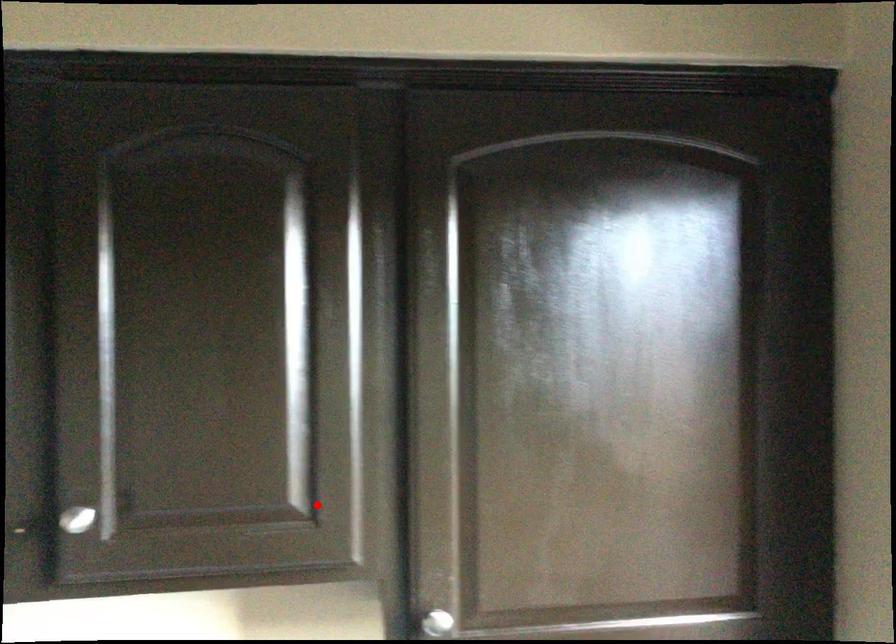
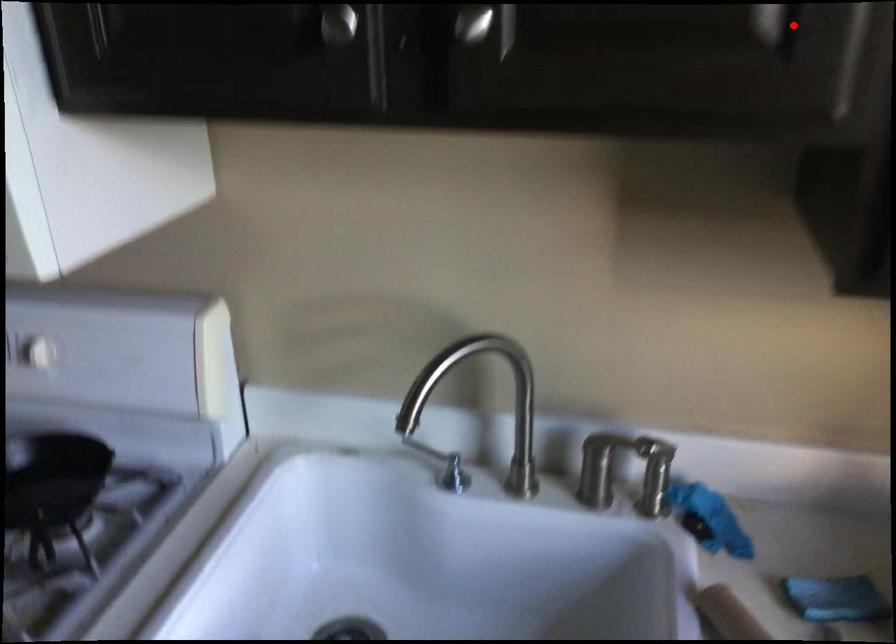
I am providing you with two images of the same scene from different viewpoints. A red point is marked on the first image and another point is marked on the second image. Does the point marked in image1 correspond to the same location as the one in image2?

Yes